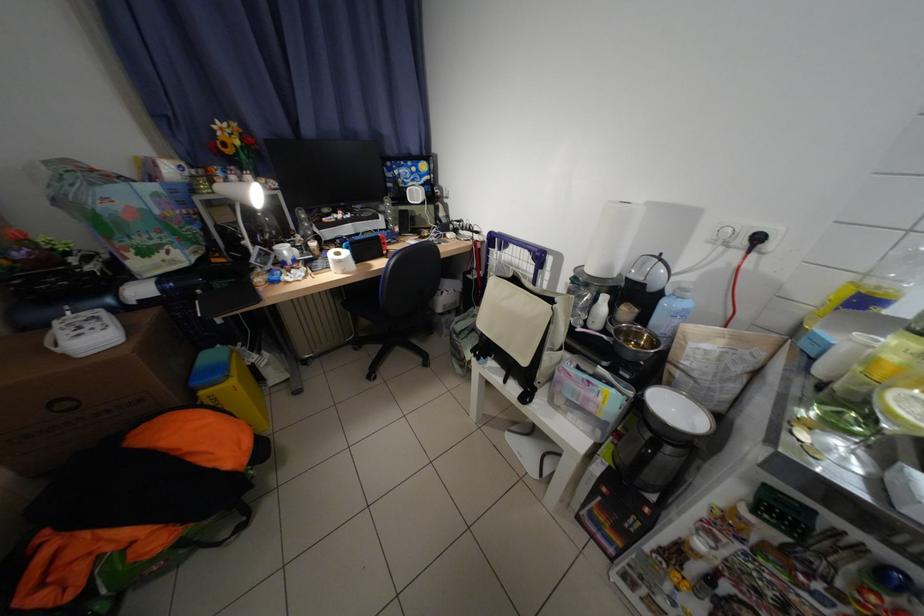
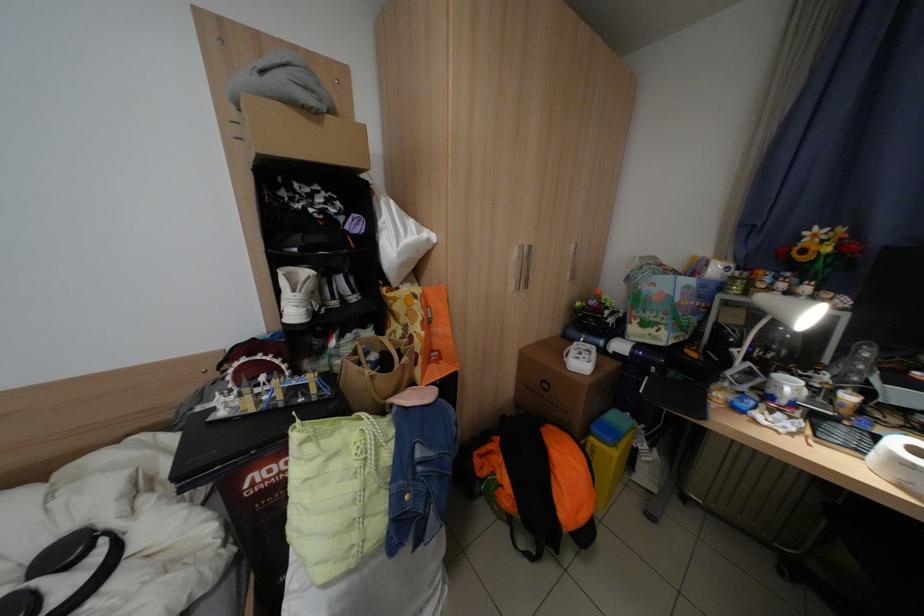
The point at (297, 252) is marked in the first image. Where is the corresponding point in the second image?

(800, 387)